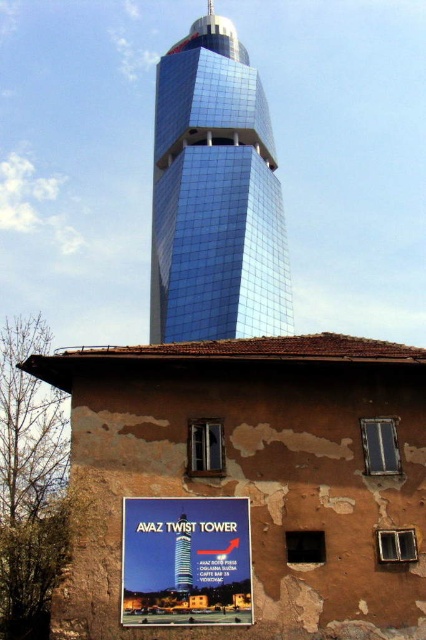
Who is more forward, (249, 333) or (233, 540)?

Point (233, 540) is more forward.

Does shiny glass tower at center come behind matte plastic sign at center?

Yes, shiny glass tower at center is further from the viewer.

Locate an element on the screen. The height and width of the screenshot is (640, 426). shiny glass tower at center is located at coordinates (215, 195).